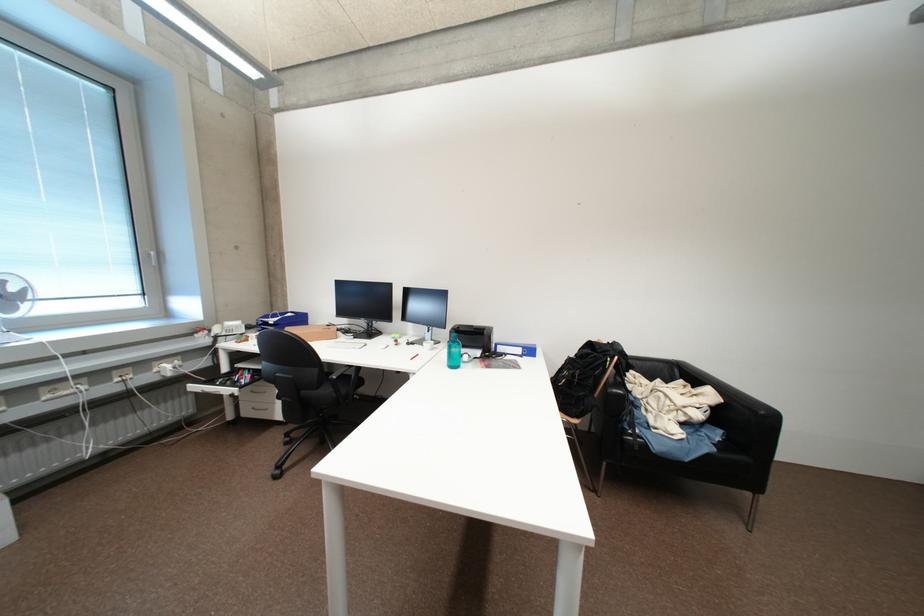
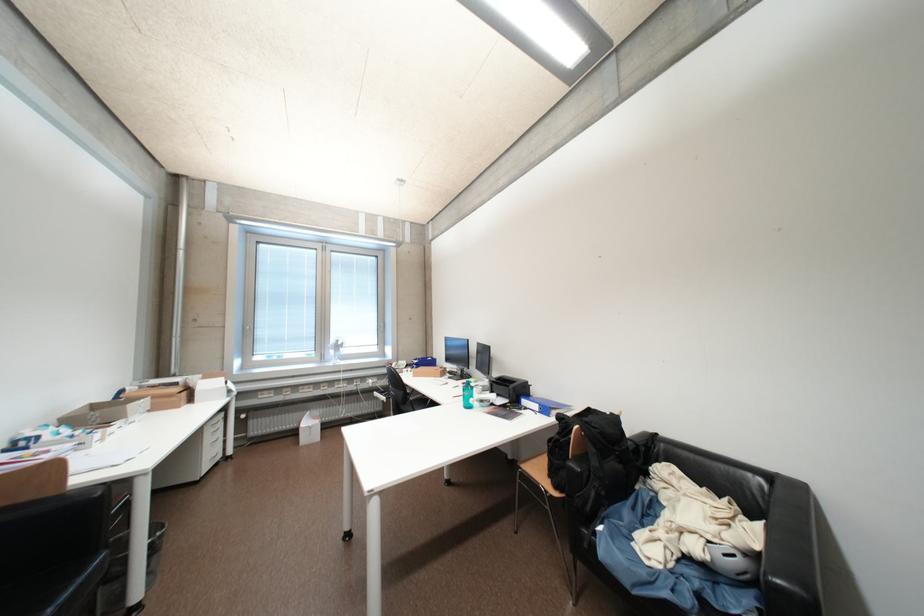
Locate, in the second image, the point that corresponds to pixel 716 391 in the first image.

(769, 528)